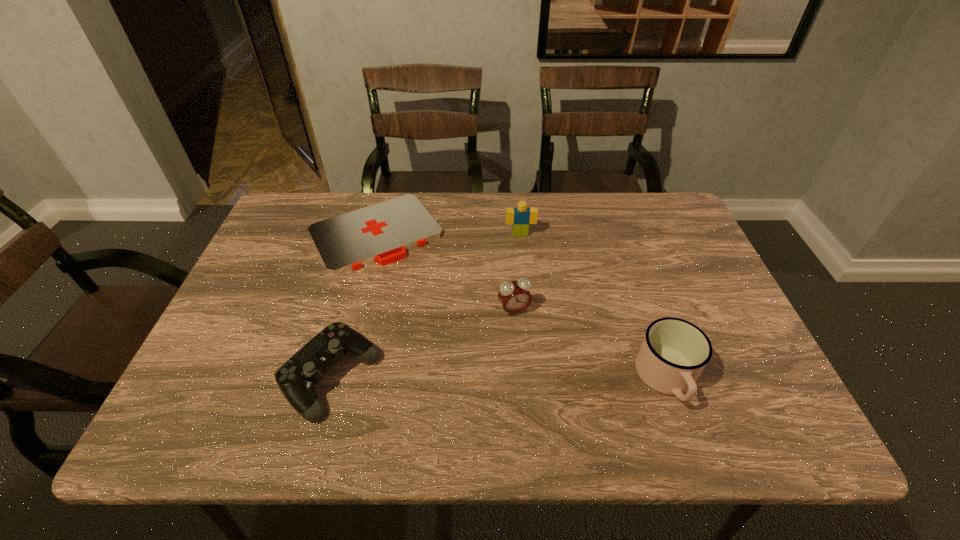
Where is `object that is positioned at the right edge`? object that is positioned at the right edge is located at coordinates (674, 352).

Where is `object located at the far left corner`? Image resolution: width=960 pixels, height=540 pixels. object located at the far left corner is located at coordinates (381, 233).

Where is `object positioned at the near right corner`? object positioned at the near right corner is located at coordinates click(x=674, y=352).

Image resolution: width=960 pixels, height=540 pixels. Find the location of `free region at the far edge of the desktop`. free region at the far edge of the desktop is located at coordinates (618, 215).

At what (x,y) coordinates should I click in order to perform the action: click on free spot at the near edge of the desktop. Please return your answer as a coordinate pair (x, y). Looking at the image, I should click on (572, 374).

Locate an element on the screen. free location at the left edge is located at coordinates (299, 249).

The height and width of the screenshot is (540, 960). What are the coordinates of `vacant space at the right edge of the desktop` in the screenshot? It's located at (669, 285).

You are a GUI agent. You are given a task and a screenshot of the screen. Output one action in this format:
    pyautogui.click(x=<x>, y=<y>)
    Task: Click on the vacant space at the far left corner of the desktop
    Image resolution: width=960 pixels, height=540 pixels.
    Given the screenshot: What is the action you would take?
    point(278,224)

I want to click on free space at the far right corner of the desktop, so click(648, 219).

Identify the location of free space between the third farthest object and the Lego. (517, 272).